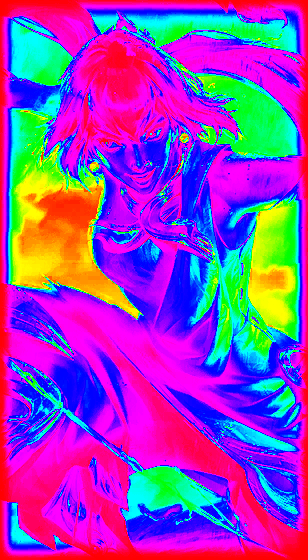
This screenshot has height=560, width=308. In order to click on edge of art piece in this screenshot , I will do [3, 549], [304, 539], [294, 3], [22, 2].